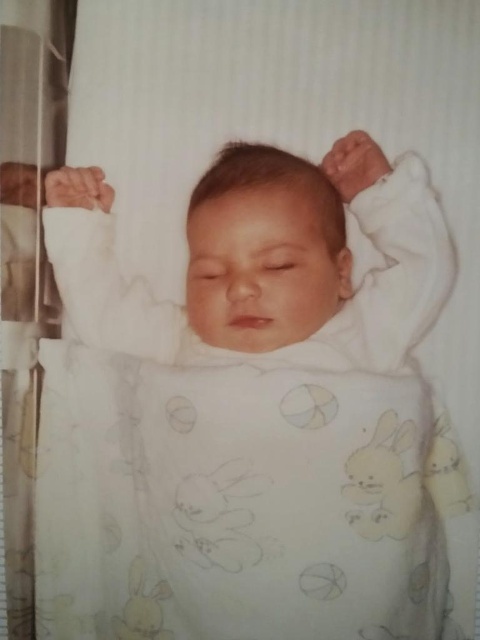
Question: Which point is farther to the camera?

Choices:
 (A) white soft newborn at center
 (B) white soft blanket at center

Answer: (A)

Question: Does white soft blanket at center have a larger size compared to white soft newborn at center?

Choices:
 (A) yes
 (B) no

Answer: (A)

Question: Does white soft blanket at center appear on the right side of white soft newborn at center?

Choices:
 (A) no
 (B) yes

Answer: (B)

Question: Can you confirm if white soft blanket at center is smaller than white soft newborn at center?

Choices:
 (A) yes
 (B) no

Answer: (B)